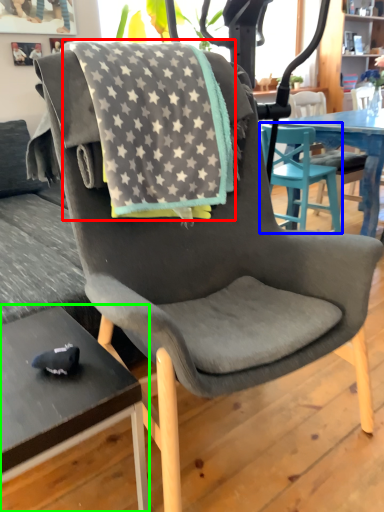
Question: Which object is the closest to the beach towel (highlighted by a red box)? Choose among these: chair (highlighted by a blue box) or desk (highlighted by a green box).

Choices:
 (A) chair
 (B) desk

Answer: (B)